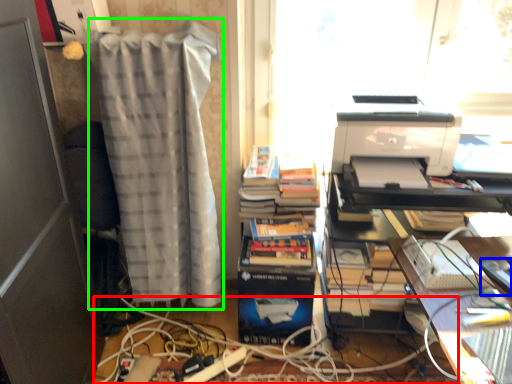
Question: Considering the real-world distances, which object is closest to cable (highlighted by a red box)? equipment (highlighted by a blue box) or curtain (highlighted by a green box).

Choices:
 (A) equipment
 (B) curtain

Answer: (B)